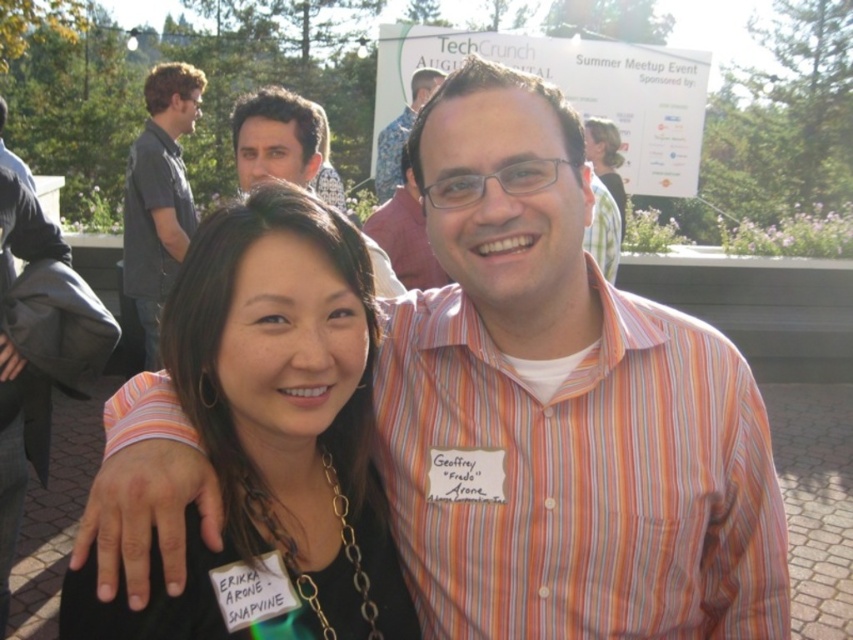
You are a photographer at the TechCrunch Summer Meetup Event. You need to take a photo of both the striped cotton shirt at center and the matte black shirt at center. Which shirt should you focus on first if you want to capture them in order from left to right?

The matte black shirt at center should be focused on first since it is positioned to the left of the striped cotton shirt at center.

You are a photographer at the TechCrunch Summer Meetup Event and need to capture a photo of both the striped cotton shirt at center and the matte black shirt at center. Based on their positions, which shirt should you focus on first to ensure both are in frame?

The striped cotton shirt at center is taller than the matte black shirt at center, so you should focus on the striped cotton shirt at center first to ensure both are in frame.

From the picture: You are organizing a photo shoot and need to ensure that the black fabric at center and the dark gray shirt at upper left are visible in the frame. Based on their heights, which object should you prioritize positioning closer to the camera to ensure visibility?

The black fabric at center has a lesser height compared to dark gray shirt at upper left, so you should prioritize positioning the black fabric at center closer to the camera to ensure visibility.